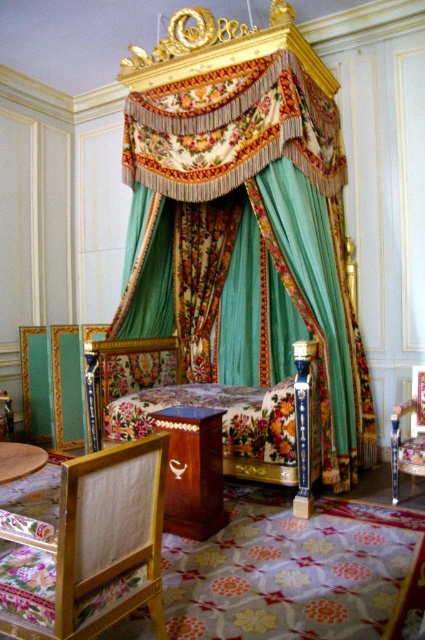
You are a guest in this luxurious bedroom and need to sit down. You see a wooden chair at lower left and a wooden table at lower center. Which one is taller?

The wooden chair at lower left is taller than the wooden table at lower center.

You are standing in the bedroom and want to take a photo of the point at coordinates (209, 458). If your camera has a focal length of 50mm and you need to be exactly 3 meters away to get the shot, should you move closer or farther away?

The point at coordinates (209, 458) is 3.29 meters away from the camera. Since you need to be exactly 3 meters away, you should move closer to reduce the distance to 3 meters.

You are standing in the bedroom and want to place a vase on the closest wooden table. Which wooden table should you choose between the wooden table at lower center and the wooden table at lower left?

You should choose the wooden table at lower center because it is closer to you than the wooden table at lower left.